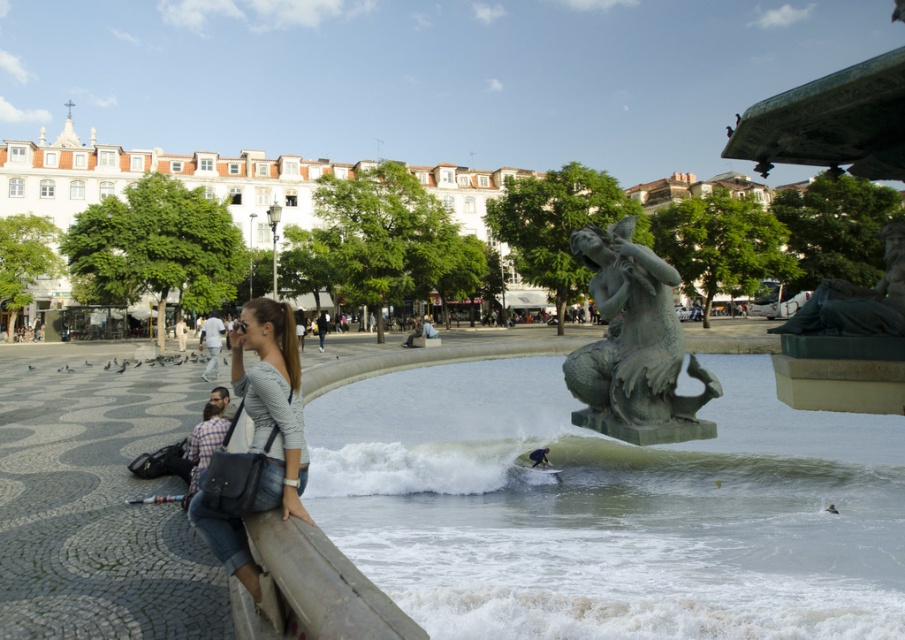
Does green patina statue at center appear over smooth green surfboard at center?

Yes.

Is point (686, 429) behind point (531, 465)?

No, it is in front of (531, 465).

This screenshot has width=905, height=640. Identify the location of green patina statue at center. (634, 346).

Who is more forward, (627,280) or (322,333)?

Point (627,280) is in front.

Who is more distant from viewer, (597, 348) or (324, 333)?

The point (324, 333) is more distant.

Locate an element on the screen. This screenshot has width=905, height=640. green patina statue at center is located at coordinates (634, 346).

I want to click on green stone water at center, so click(x=610, y=509).

Is point (443, 481) in front of point (634, 289)?

No, it is not.

Is point (735, 609) in front of point (621, 404)?

Yes, point (735, 609) is closer to viewer.

Where is `green stone water at center`? The image size is (905, 640). green stone water at center is located at coordinates (610, 509).